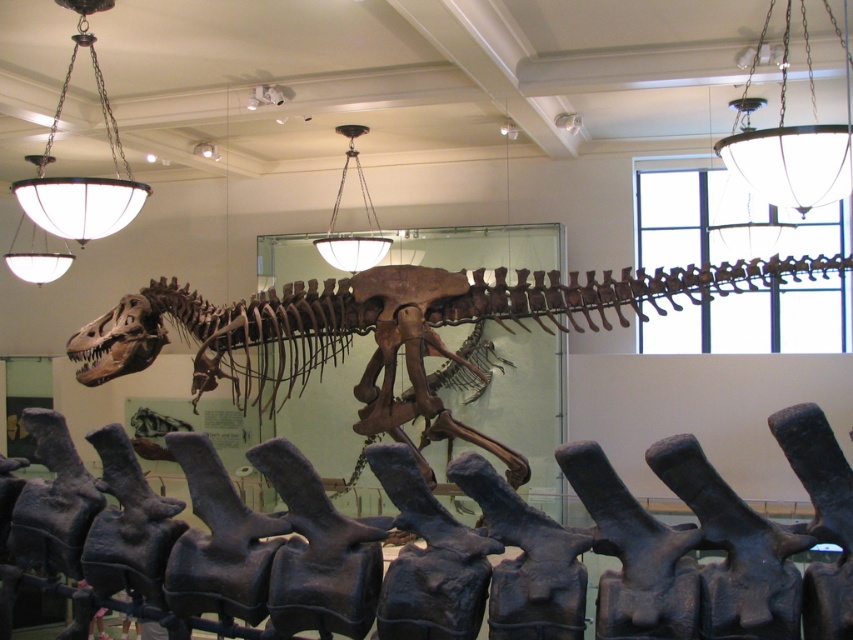
Question: Which point is closer to the camera taking this photo?

Choices:
 (A) (115, 214)
 (B) (804, 29)
 (C) (281, 454)

Answer: (C)

Question: Which point is farther to the camera?

Choices:
 (A) brown bone at center
 (B) matte glass chandelier at upper center
 (C) white glass chandelier at upper center
 (D) white glass chandelier at upper left

Answer: (C)

Question: Can you confirm if brown bone at center is bigger than white glass chandelier at upper left?

Choices:
 (A) no
 (B) yes

Answer: (B)

Question: Is brown bone at center below white glass chandelier at upper center?

Choices:
 (A) yes
 (B) no

Answer: (A)

Question: Which object appears farthest from the camera in this image?

Choices:
 (A) brown bone at center
 (B) rusty metallic dinosaur at center

Answer: (A)

Question: Can you confirm if rusty metallic dinosaur at center is thinner than brown bone at center?

Choices:
 (A) yes
 (B) no

Answer: (A)